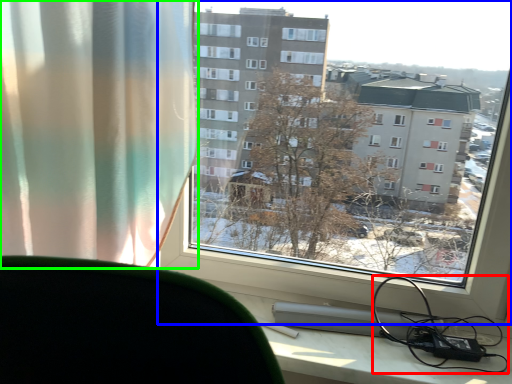
Question: Which object is the farthest from cable (highlighted by a red box)? Choose among these: window (highlighted by a blue box) or curtain (highlighted by a green box).

Choices:
 (A) window
 (B) curtain

Answer: (B)